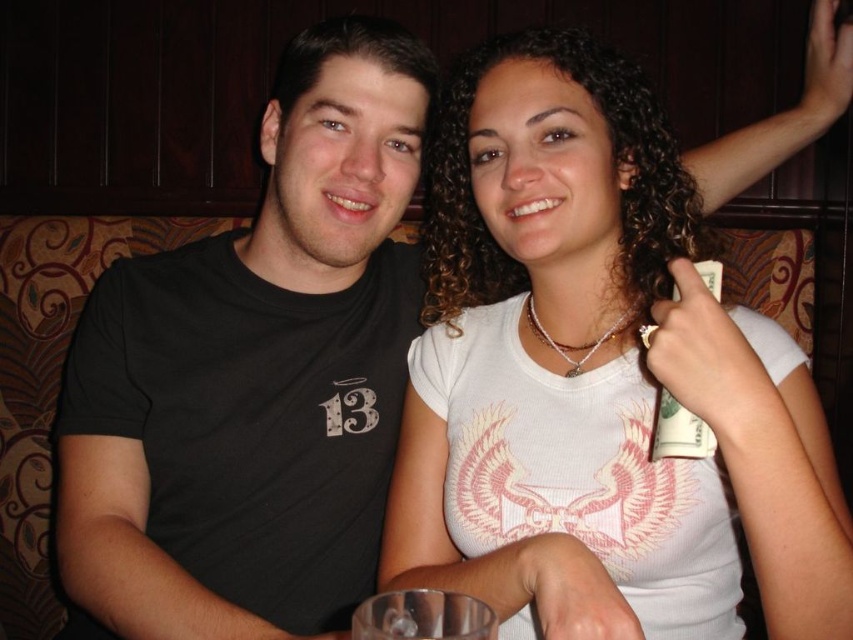
Is white matte shirt at upper right above black matte t-shirt at left?

Yes.

At what (x,y) coordinates should I click in order to perform the action: click on white matte shirt at upper right. Please return your answer as a coordinate pair (x, y). The image size is (853, 640). Looking at the image, I should click on (595, 364).

Can you confirm if white matte shirt at upper right is positioned to the left of white paper money at upper right?

Correct, you'll find white matte shirt at upper right to the left of white paper money at upper right.

I want to click on white matte shirt at upper right, so 595,364.

Consider the image. Measure the distance from black matte t-shirt at left to white paper money at upper right.

black matte t-shirt at left is 20.14 inches away from white paper money at upper right.

Which is more to the right, black matte t-shirt at left or white paper money at upper right?

white paper money at upper right is more to the right.

Which is behind, point (279, 449) or point (694, 451)?

The point (279, 449) is more distant.

At what (x,y) coordinates should I click in order to perform the action: click on black matte t-shirt at left. Please return your answer as a coordinate pair (x, y). The image size is (853, 640). Looking at the image, I should click on (254, 376).